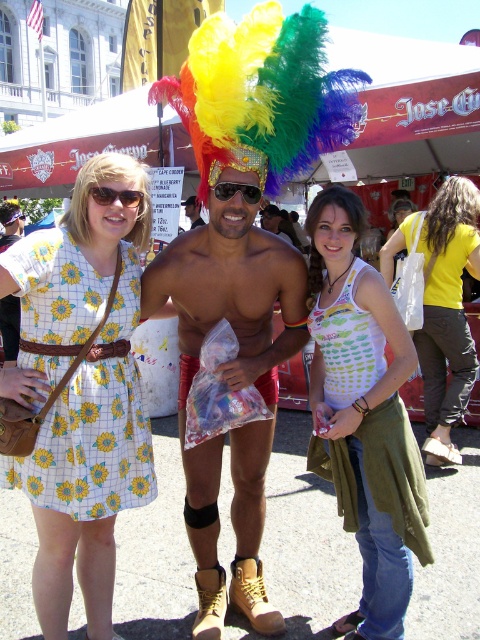
Does white canvas tote bag at center appear under rainbow feather headdress at center?

Indeed, white canvas tote bag at center is positioned under rainbow feather headdress at center.

Can you confirm if white canvas tote bag at center is wider than rainbow feather headdress at center?

Yes, white canvas tote bag at center is wider than rainbow feather headdress at center.

The image size is (480, 640). What are the coordinates of `white canvas tote bag at center` in the screenshot? It's located at (446, 312).

Between point (217, 611) and point (199, 209), which one is positioned in front?

Positioned in front is point (217, 611).

From the picture: Is shiny metallic boots at center wider than rainbow feather headdress at center?

Correct, the width of shiny metallic boots at center exceeds that of rainbow feather headdress at center.

You are a GUI agent. You are given a task and a screenshot of the screen. Output one action in this format:
    pyautogui.click(x=<x>, y=<y>)
    Task: Click on the shiny metallic boots at center
    The width and height of the screenshot is (480, 640).
    Given the screenshot: What is the action you would take?
    pyautogui.click(x=239, y=346)

Does sunglasses at center appear on the left side of rainbow feather headdress at center?

No, sunglasses at center is not to the left of rainbow feather headdress at center.

Can you confirm if sunglasses at center is positioned to the right of rainbow feather headdress at center?

Correct, you'll find sunglasses at center to the right of rainbow feather headdress at center.

Where is `sunglasses at center`? sunglasses at center is located at coordinates (237, 192).